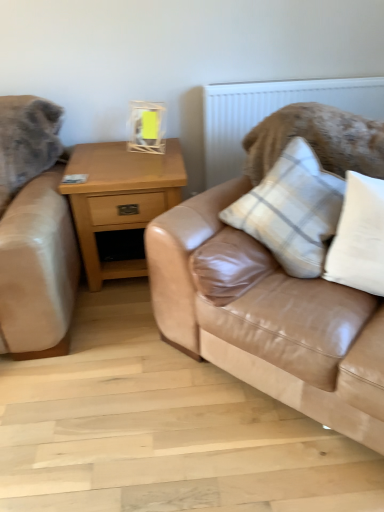
Question: Is tan leather couch at center wider or thinner than light brown wood nightstand at center?

Choices:
 (A) wide
 (B) thin

Answer: (A)

Question: Is tan leather couch at center inside or outside of light brown wood nightstand at center?

Choices:
 (A) outside
 (B) inside

Answer: (A)

Question: Which object is the farthest from the matte yellow glass at upper center?

Choices:
 (A) white cotton pillow at upper right, arranged as the 2th pillow when viewed from the left
 (B) plaid fabric pillow at center, which is counted as the 1th pillow, starting from the left
 (C) white textured radiator at upper center
 (D) tan leather couch at center
 (E) light brown wood nightstand at center

Answer: (A)

Question: Which object is the closest to the matte yellow glass at upper center?

Choices:
 (A) plaid fabric pillow at center, which is counted as the 1th pillow, starting from the left
 (B) tan leather couch at center
 (C) white cotton pillow at upper right, arranged as the 2th pillow when viewed from the left
 (D) light brown wood nightstand at center
 (E) white textured radiator at upper center

Answer: (D)